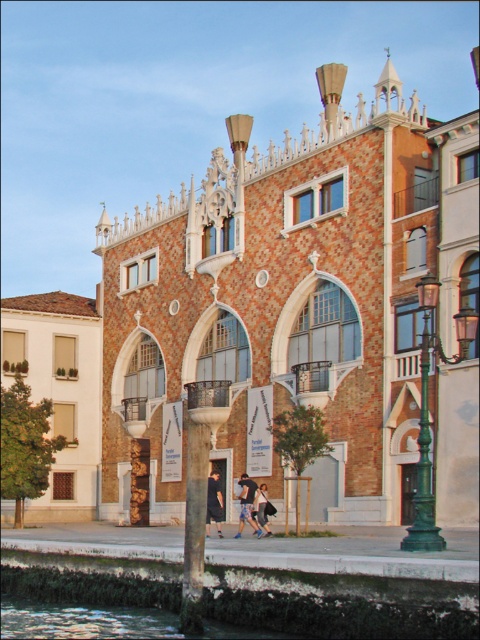
This screenshot has height=640, width=480. What do you see at coordinates (247, 504) in the screenshot? I see `dark blue fabric at center` at bounding box center [247, 504].

Is the position of dark blue fabric at center less distant than that of denim pants at lower center?

Yes, dark blue fabric at center is in front of denim pants at lower center.

What do you see at coordinates (247, 504) in the screenshot?
I see `dark blue fabric at center` at bounding box center [247, 504].

I want to click on dark blue fabric at center, so click(x=247, y=504).

Can you confirm if dark gray fabric pants at center is bigger than dark blue fabric at center?

Yes, dark gray fabric pants at center is bigger than dark blue fabric at center.

Which is behind, point (222, 515) or point (243, 486)?

Point (243, 486)

The width and height of the screenshot is (480, 640). Describe the element at coordinates (214, 502) in the screenshot. I see `dark gray fabric pants at center` at that location.

At what (x,y) coordinates should I click in order to perform the action: click on dark gray fabric pants at center. Please return your answer as a coordinate pair (x, y). This screenshot has width=480, height=640. Looking at the image, I should click on (214, 502).

Does green metal lamp post at lower right have a larger size compared to dark gray fabric pants at center?

Indeed, green metal lamp post at lower right has a larger size compared to dark gray fabric pants at center.

Describe the element at coordinates (428, 412) in the screenshot. I see `green metal lamp post at lower right` at that location.

Which is in front, point (464, 337) or point (217, 528)?

Point (464, 337) is more forward.

The height and width of the screenshot is (640, 480). Find the location of `green metal lamp post at lower right`. green metal lamp post at lower right is located at coordinates (428, 412).